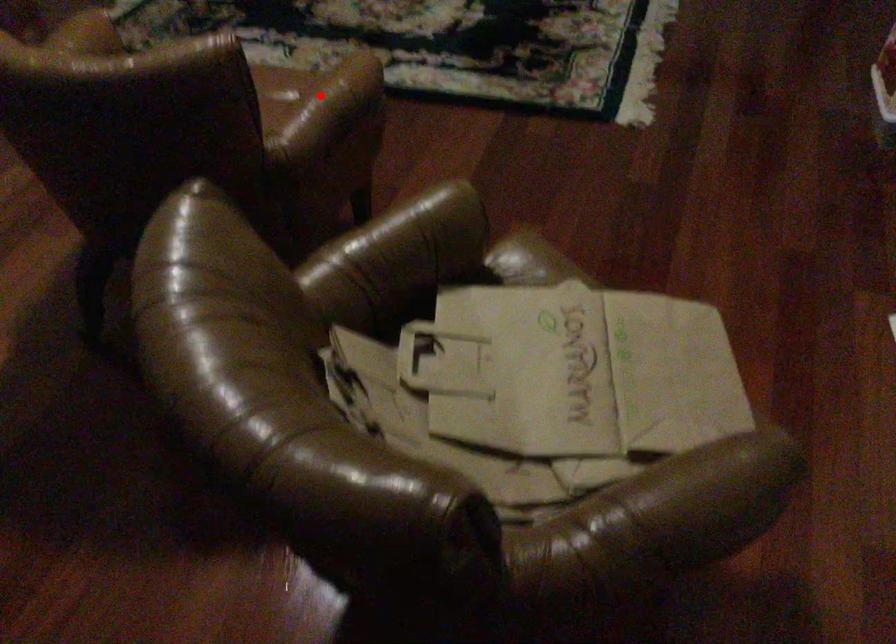
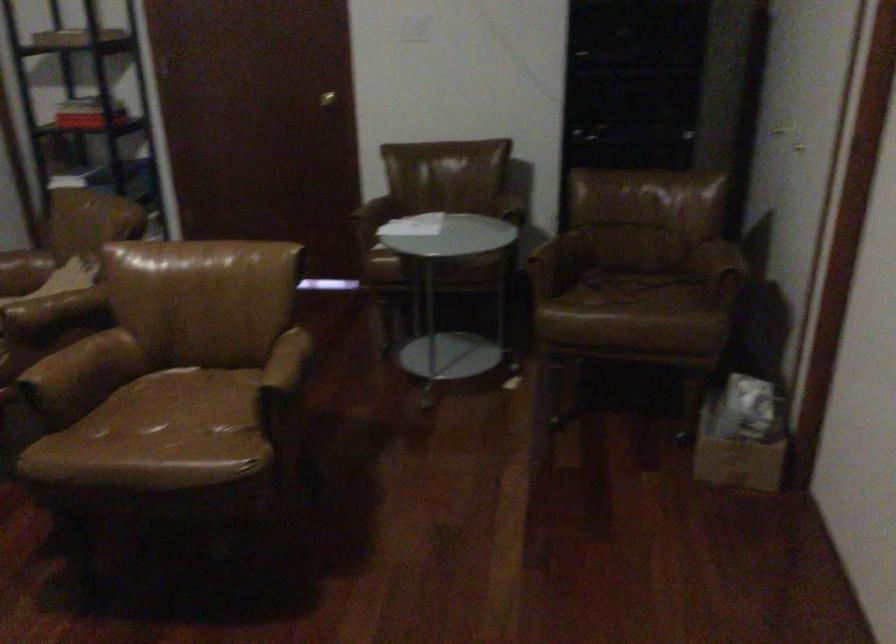
Where in the second image is the point corresponding to the highlighted location from the first image?

(61, 361)